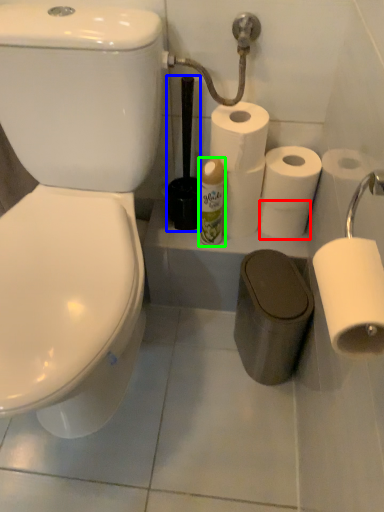
Question: Which object is positioned farthest from toilet paper (highlighted by a red box)? Select from brush (highlighted by a blue box) and toiletry (highlighted by a green box).

Choices:
 (A) brush
 (B) toiletry

Answer: (A)